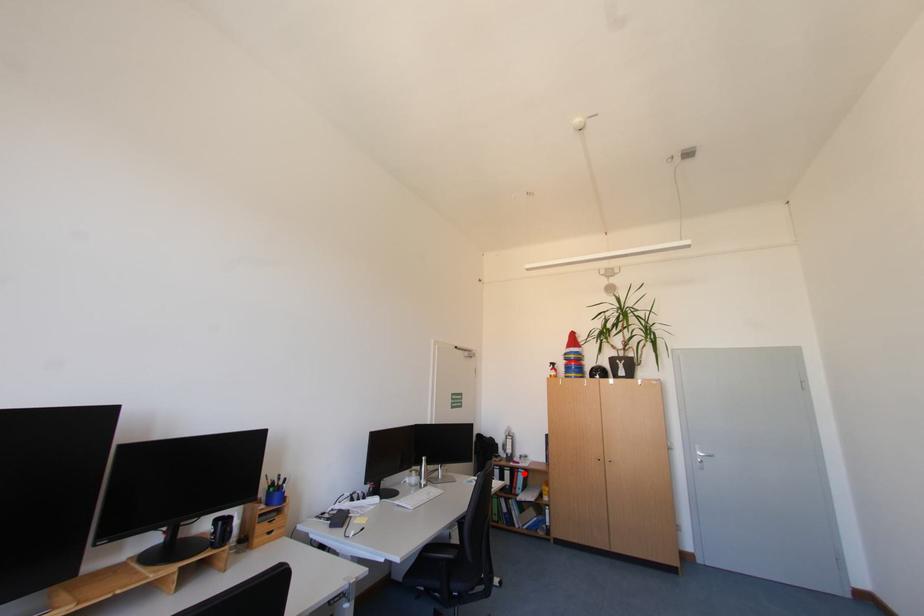
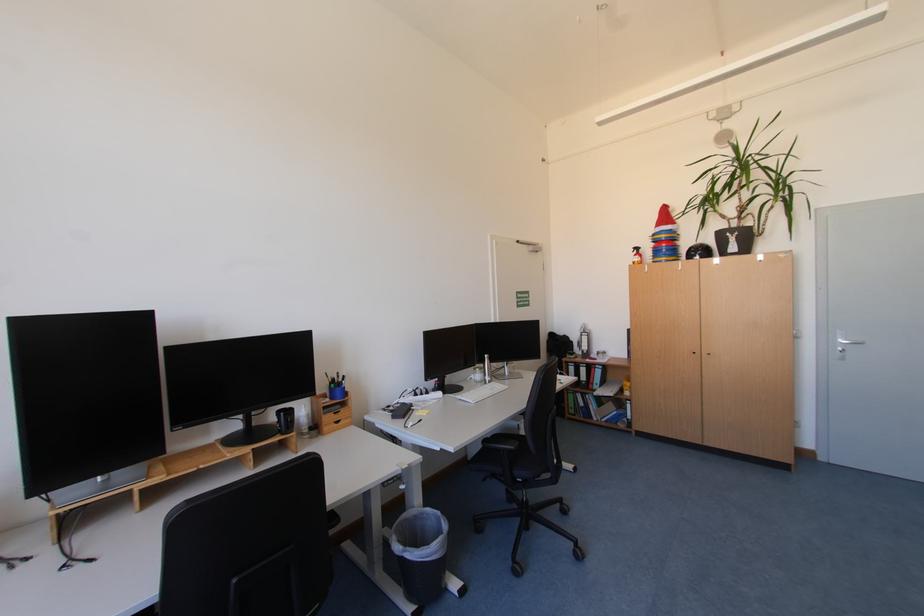
Where in the second image is the point corresponding to the highlighted location from the first image?

(601, 370)